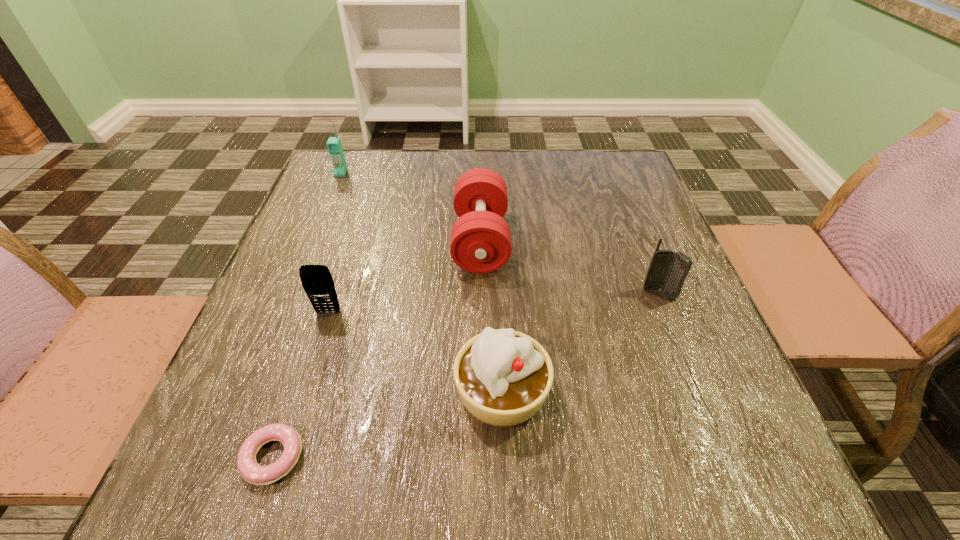
The height and width of the screenshot is (540, 960). What are the coordinates of `object at the near left corner` in the screenshot? It's located at (249, 469).

This screenshot has width=960, height=540. Identify the location of free region at the far edge of the desktop. (412, 185).

In the image, there is a desktop. Where is `vacant region at the near edge`? The image size is (960, 540). vacant region at the near edge is located at coordinates (517, 453).

In the image, there is a desktop. Identify the location of vacant space at the left edge. This screenshot has height=540, width=960. (286, 310).

At what (x,y) coordinates should I click in order to perform the action: click on free space at the right edge of the desktop. Please return your answer as a coordinate pair (x, y). Looking at the image, I should click on (675, 249).

Identify the location of free space at the near left corner of the desktop. The image size is (960, 540). (229, 449).

The height and width of the screenshot is (540, 960). In the image, there is a desktop. What are the coordinates of `free space at the far right corner` in the screenshot? It's located at (587, 164).

I want to click on empty space between the third nearest object and the whipped cream, so click(x=415, y=352).

Where is `free space between the doughnut and the whipped cream`? The image size is (960, 540). free space between the doughnut and the whipped cream is located at coordinates (388, 424).

Identify the location of empty location between the shortest object and the nearest cellular telephone. Image resolution: width=960 pixels, height=540 pixels. (300, 385).